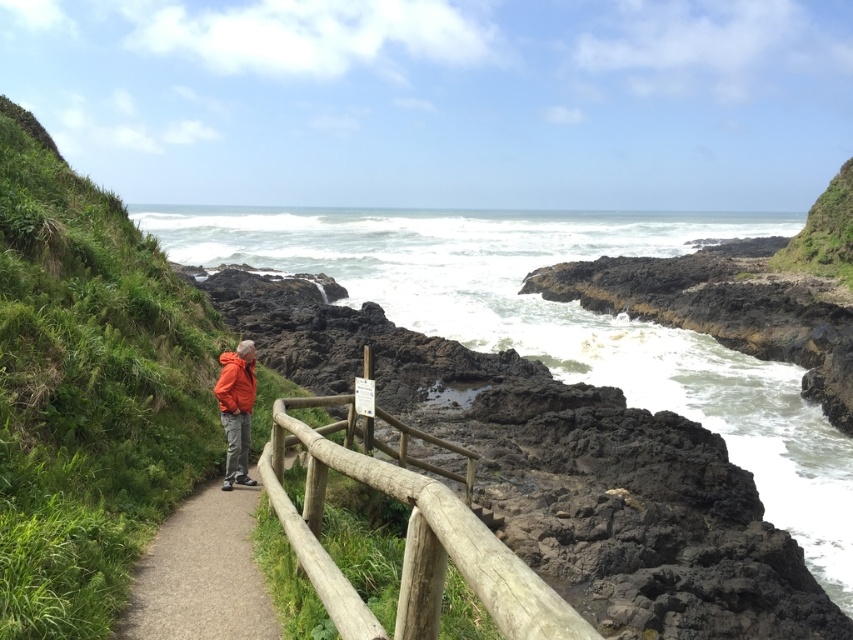
Question: Which object is closer to the camera taking this photo?

Choices:
 (A) orange fleece jacket at center
 (B) gravel path at center
 (C) natural wood railing at center

Answer: (C)

Question: Which object is farther from the camera taking this photo?

Choices:
 (A) gravel path at center
 (B) orange fleece jacket at center

Answer: (B)

Question: Estimate the real-world distances between objects in this image. Which object is farther from the natural wood railing at center?

Choices:
 (A) orange fleece jacket at center
 (B) gravel path at center

Answer: (A)

Question: Is gravel path at center smaller than orange fleece jacket at center?

Choices:
 (A) no
 (B) yes

Answer: (A)

Question: In this image, where is natural wood railing at center located relative to orange fleece jacket at center?

Choices:
 (A) right
 (B) left

Answer: (A)

Question: From the image, what is the correct spatial relationship of natural wood railing at center in relation to orange fleece jacket at center?

Choices:
 (A) above
 (B) below

Answer: (B)